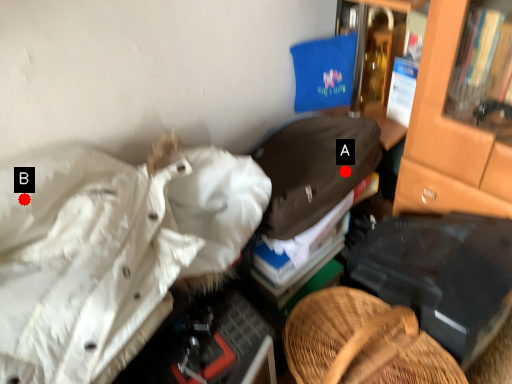
Question: Two points are circled on the image, labeled by A and B beside each circle. Which point is closer to the camera taking this photo?

Choices:
 (A) A is closer
 (B) B is closer

Answer: (B)